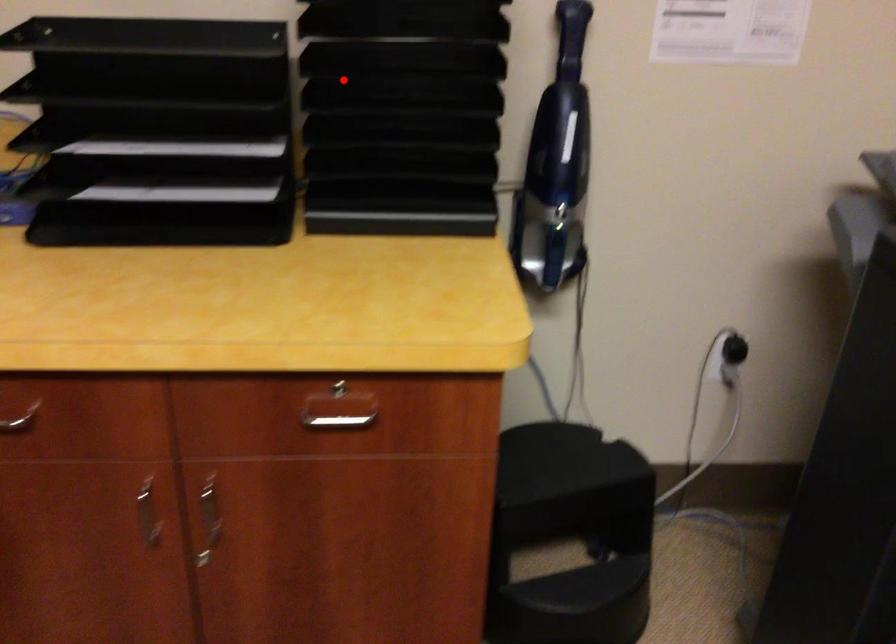
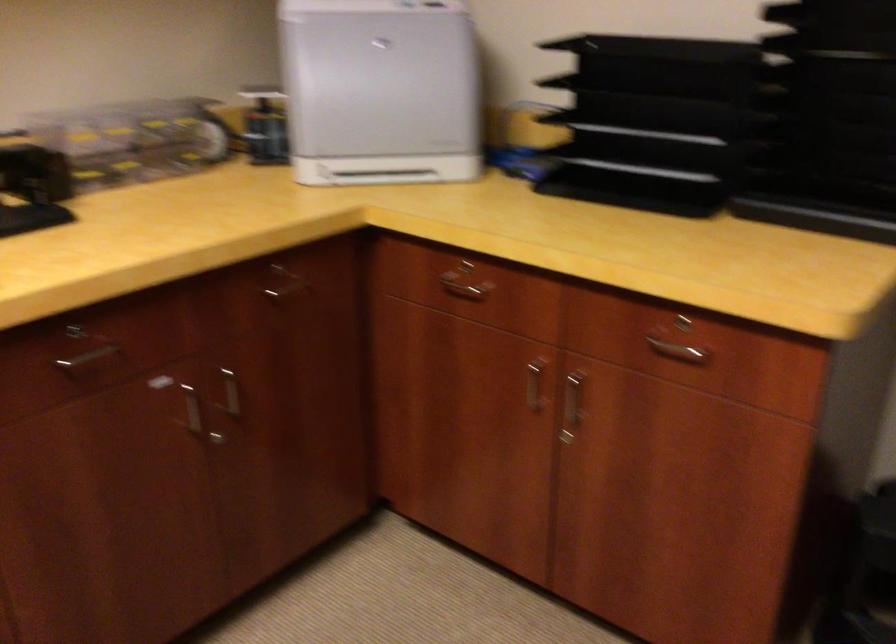
In the second image, find the point that corresponds to the highlighted location in the first image.

(823, 93)